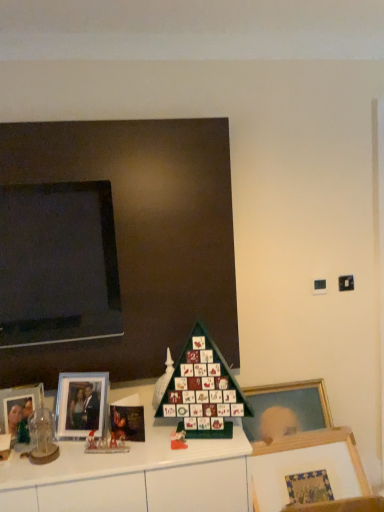
At what (x,y) coordinates should I click in order to perform the action: click on vacant space to the left of matte plastic advent calendar at center, the second toy viewed from the back. Please return your answer as a coordinate pair (x, y). The height and width of the screenshot is (512, 384). Looking at the image, I should click on (144, 446).